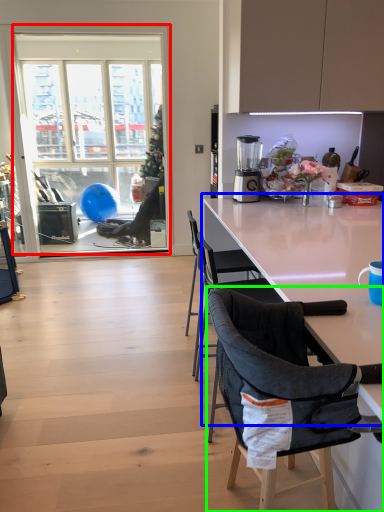
Question: Which object is the closest to the window (highlighted by a red box)? Choose among these: kitchen & dining room table (highlighted by a blue box) or chair (highlighted by a green box).

Choices:
 (A) kitchen & dining room table
 (B) chair

Answer: (A)